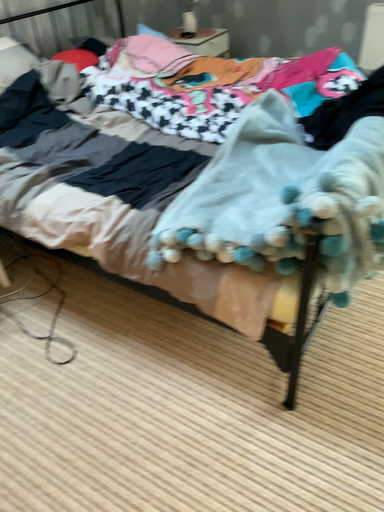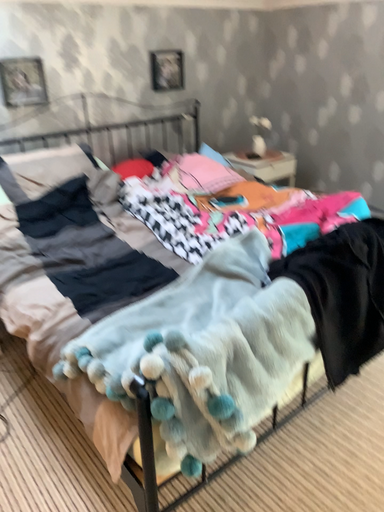
Question: How did the camera likely rotate when shooting the video?

Choices:
 (A) rotated left
 (B) rotated right

Answer: (A)